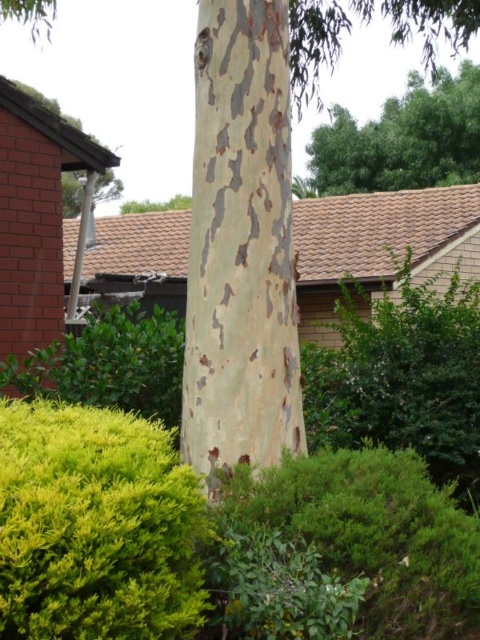
Question: Which point is closer to the camera?

Choices:
 (A) speckled bark tree trunk at center
 (B) green leafy bush at lower center
 (C) green leafy tree at upper center
 (D) yellow-green textured bush at lower left

Answer: (D)

Question: Can you confirm if green leafy bush at lower center is smaller than green leafy bush at center?

Choices:
 (A) yes
 (B) no

Answer: (A)

Question: Which point is farther to the camera?

Choices:
 (A) green leafy bush at center
 (B) green leafy tree at upper center
 (C) green leafy bush at lower center
 (D) yellow-green textured bush at lower left

Answer: (B)

Question: Which object is positioned farthest from the green leafy bush at lower center?

Choices:
 (A) yellow-green textured bush at lower left
 (B) speckled bark tree trunk at center
 (C) green leafy tree at upper center
 (D) green leafy bush at center

Answer: (C)

Question: Does green leafy bush at lower center appear over green leafy tree at upper center?

Choices:
 (A) no
 (B) yes

Answer: (A)

Question: Can you confirm if green leafy bush at lower center is positioned to the left of green leafy tree at upper center?

Choices:
 (A) no
 (B) yes

Answer: (B)